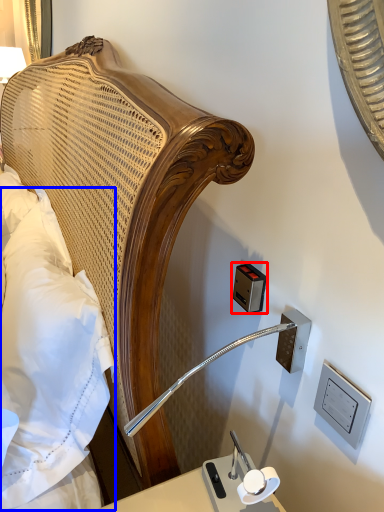
Question: Which object appears farthest to the camera in this image, electric outlet (highlighted by a red box) or pillow (highlighted by a blue box)?

Choices:
 (A) electric outlet
 (B) pillow

Answer: (A)